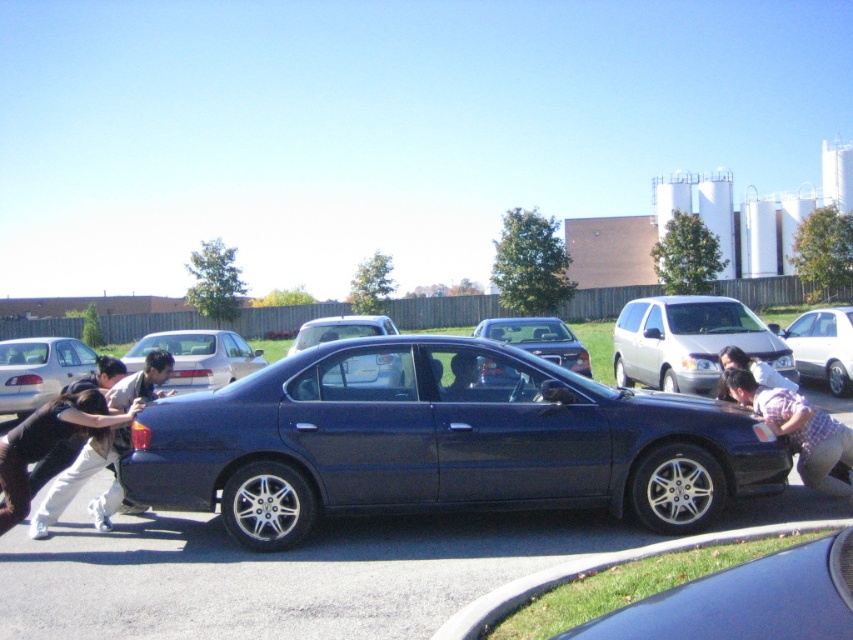
Question: Is silver metallic sedan at center to the right of plaid shirt at lower right from the viewer's perspective?

Choices:
 (A) no
 (B) yes

Answer: (B)

Question: Is glossy dark blue sedan at lower center above satin black sedan at center?

Choices:
 (A) no
 (B) yes

Answer: (A)

Question: Which of these objects is positioned farthest from the satin silver sedan at center?

Choices:
 (A) silver metallic sedan at center
 (B) white cotton pants at lower left

Answer: (A)

Question: Does glossy metallic sedan at center appear on the right side of white cotton pants at lower left?

Choices:
 (A) no
 (B) yes

Answer: (B)

Question: Which point is farther from the camera taking this photo?

Choices:
 (A) (358, 330)
 (B) (436, 400)
 (C) (764, 632)

Answer: (A)

Question: Among these points, which one is nearest to the camera?

Choices:
 (A) (102, 417)
 (B) (305, 323)
 (C) (320, 508)

Answer: (C)